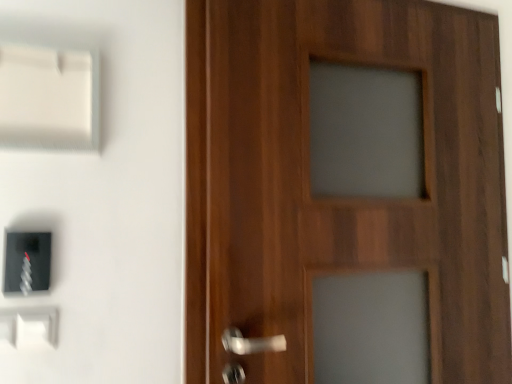
Question: Is wooden door at right located within white plastic light switch at lower left, the third light switch from the top?

Choices:
 (A) no
 (B) yes

Answer: (A)

Question: From a real-world perspective, is white plastic light switch at lower left, the third light switch from the top, positioned over wooden door at right based on gravity?

Choices:
 (A) no
 (B) yes

Answer: (A)

Question: From a real-world perspective, is white plastic light switch at lower left, the third light switch from the top, physically below wooden door at right?

Choices:
 (A) no
 (B) yes

Answer: (B)

Question: Is white plastic light switch at lower left, the first light switch positioned from the bottom, to the right of wooden door at right from the viewer's perspective?

Choices:
 (A) yes
 (B) no

Answer: (B)

Question: Is white plastic light switch at lower left, the third light switch from the top, facing away from wooden door at right?

Choices:
 (A) no
 (B) yes

Answer: (A)

Question: In terms of width, does wooden door at right look wider or thinner when compared to white plastic light switch at lower left, the third light switch from the top?

Choices:
 (A) thin
 (B) wide

Answer: (B)

Question: Based on their sizes in the image, would you say wooden door at right is bigger or smaller than white plastic light switch at lower left, the first light switch positioned from the bottom?

Choices:
 (A) big
 (B) small

Answer: (A)

Question: Considering the relative positions of wooden door at right and white plastic light switch at lower left, the first light switch positioned from the bottom, in the image provided, is wooden door at right to the left or to the right of white plastic light switch at lower left, the first light switch positioned from the bottom,?

Choices:
 (A) left
 (B) right

Answer: (B)

Question: Would you say wooden door at right is inside or outside white plastic light switch at lower left, the third light switch from the top?

Choices:
 (A) inside
 (B) outside

Answer: (B)

Question: Is wooden door at right inside or outside of white plastic light switch at upper left, the first light switch in the top-to-bottom sequence?

Choices:
 (A) inside
 (B) outside

Answer: (B)

Question: Considering the positions of point (476, 51) and point (96, 82), is point (476, 51) closer or farther from the camera than point (96, 82)?

Choices:
 (A) farther
 (B) closer

Answer: (A)

Question: Is wooden door at right in front of or behind white plastic light switch at upper left, the third light switch when ordered from bottom to top, in the image?

Choices:
 (A) front
 (B) behind

Answer: (B)

Question: From their relative heights in the image, would you say wooden door at right is taller or shorter than white plastic light switch at upper left, the third light switch when ordered from bottom to top?

Choices:
 (A) short
 (B) tall

Answer: (B)

Question: Is point (6, 331) positioned closer to the camera than point (28, 283)?

Choices:
 (A) closer
 (B) farther

Answer: (A)

Question: From a real-world perspective, is white plastic light switch at lower left, the first light switch positioned from the bottom, physically located above or below black plastic light switch at lower left, which is the 2th light switch in top-to-bottom order?

Choices:
 (A) above
 (B) below

Answer: (B)